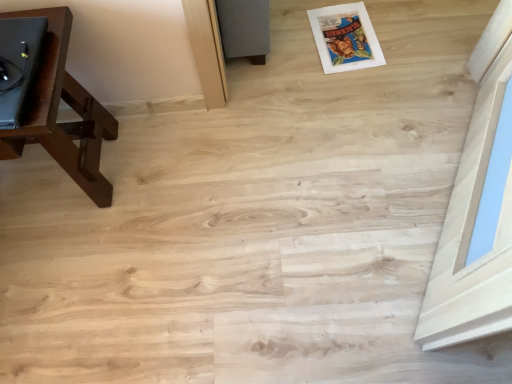
Find the location of a particular element. The height and width of the screenshot is (384, 512). vacant space to the right of brown wood tv stand at left is located at coordinates (173, 173).